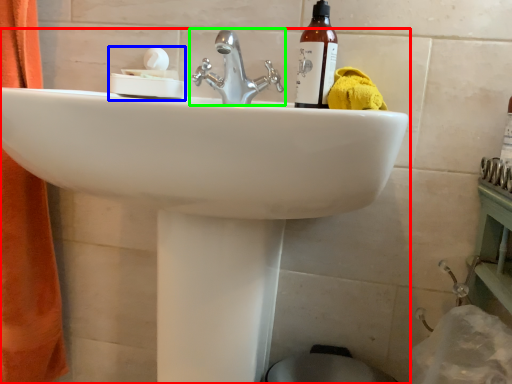
Question: Considering the real-world distances, which object is farthest from sink (highlighted by a red box)? tissue (highlighted by a blue box) or tap (highlighted by a green box)?

Choices:
 (A) tissue
 (B) tap

Answer: (A)